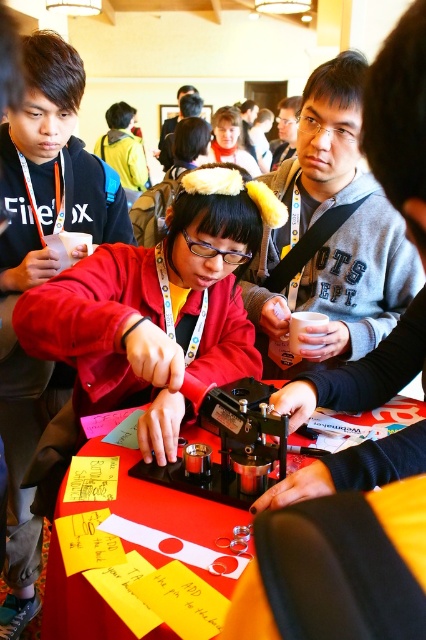
Can you confirm if gray fleece sweatshirt at center is wider than matte black shirt at center?

Yes.

Is gray fleece sweatshirt at center smaller than matte black shirt at center?

No, gray fleece sweatshirt at center is not smaller than matte black shirt at center.

Which is behind, point (357, 285) or point (20, 232)?

Positioned behind is point (20, 232).

Locate an element on the screen. gray fleece sweatshirt at center is located at coordinates (331, 234).

Does gray fleece sweatshirt at center have a larger size compared to red plastic table at center?

Yes, gray fleece sweatshirt at center is bigger than red plastic table at center.

Is gray fleece sweatshirt at center further to camera compared to red plastic table at center?

Yes, it is.

Is point (302, 276) positioned behind point (193, 557)?

Yes.

Locate an element on the screen. gray fleece sweatshirt at center is located at coordinates (331, 234).

Does matte black shirt at center have a smaller size compared to red plastic table at center?

Yes, matte black shirt at center is smaller than red plastic table at center.

Find the location of `matte black shirt at center`. matte black shirt at center is located at coordinates point(51,168).

Image resolution: width=426 pixels, height=640 pixels. I want to click on matte black shirt at center, so click(51, 168).